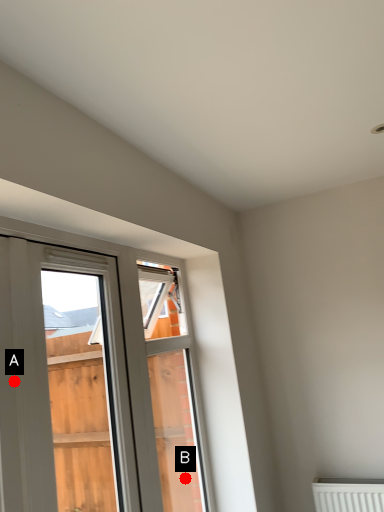
Question: Two points are circled on the image, labeled by A and B beside each circle. Which point is closer to the camera?

Choices:
 (A) A is closer
 (B) B is closer

Answer: (A)